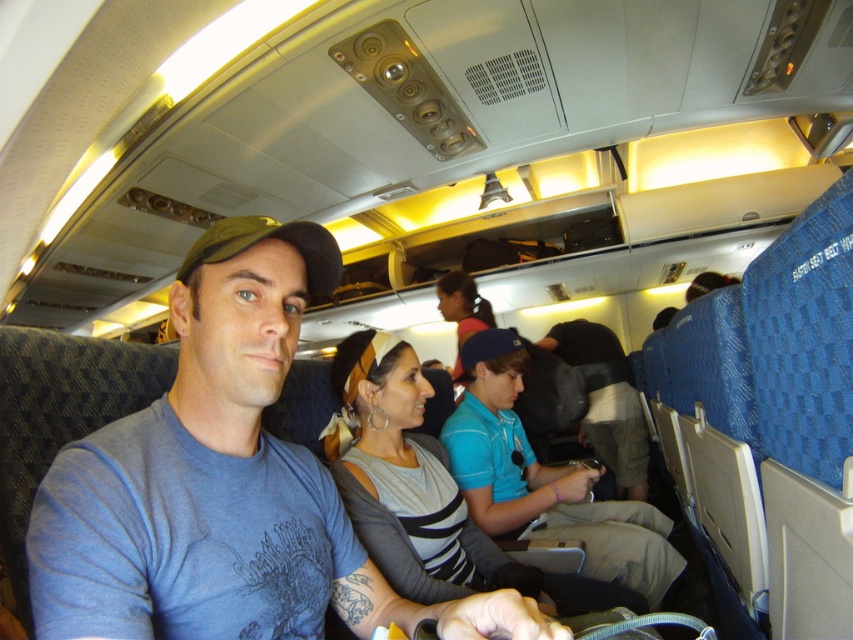
Which is in front, point (527, 628) or point (357, 502)?

Point (527, 628) is more forward.

Is point (259, 516) closer to viewer compared to point (399, 522)?

Yes.

Which is behind, point (196, 568) or point (345, 465)?

Point (345, 465)

The image size is (853, 640). Identify the location of matte blue t-shirt at center. (224, 483).